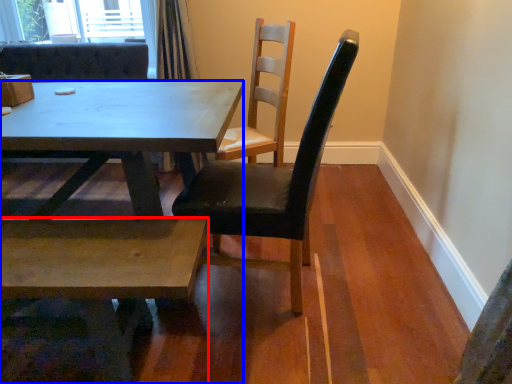
Question: Which of the following is the closest to the observer, coffee table (highlighted by a red box) or kitchen & dining room table (highlighted by a blue box)?

Choices:
 (A) coffee table
 (B) kitchen & dining room table

Answer: (A)